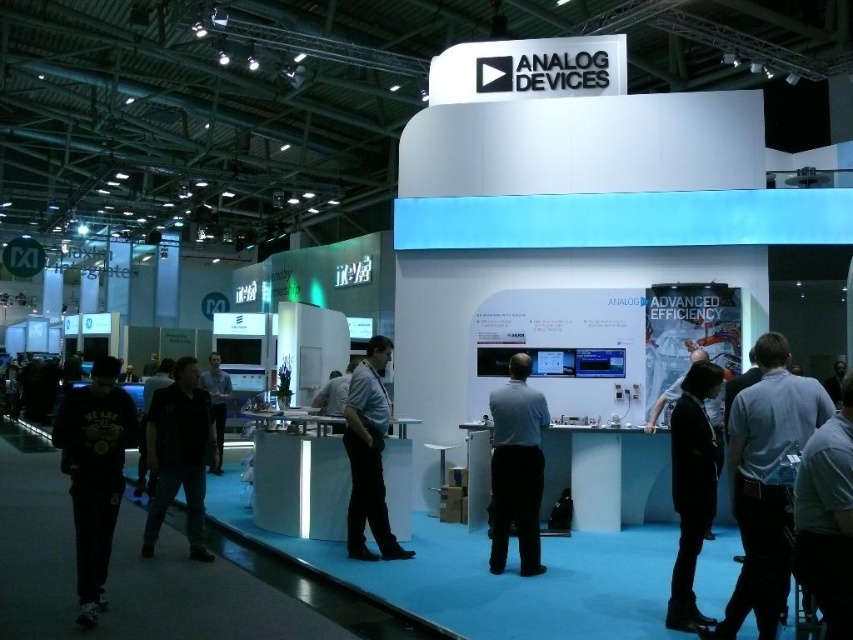
Does black leather jacket at lower right have a lesser width compared to black shirt at center?

Indeed, black leather jacket at lower right has a lesser width compared to black shirt at center.

Identify the location of black leather jacket at lower right. (692, 486).

Identify the location of black leather jacket at lower right. (692, 486).

Can you confirm if black shirt at center is positioned to the right of dark gray shirt at center?

Correct, you'll find black shirt at center to the right of dark gray shirt at center.

Can you confirm if black shirt at center is wider than dark gray shirt at center?

Correct, the width of black shirt at center exceeds that of dark gray shirt at center.

Does point (367, 506) come closer to viewer compared to point (219, 369)?

Yes, it is.

The image size is (853, 640). In order to click on black shirt at center in this screenshot , I will do `click(368, 456)`.

How far apart are dark gray fabric chair at lower right and black shirt at center?

dark gray fabric chair at lower right is 3.11 meters away from black shirt at center.

From the picture: Which is more to the left, dark gray fabric chair at lower right or black shirt at center?

Positioned to the left is black shirt at center.

This screenshot has width=853, height=640. In order to click on dark gray fabric chair at lower right in this screenshot , I will do `click(827, 518)`.

Locate an element on the screen. dark gray fabric chair at lower right is located at coordinates (827, 518).